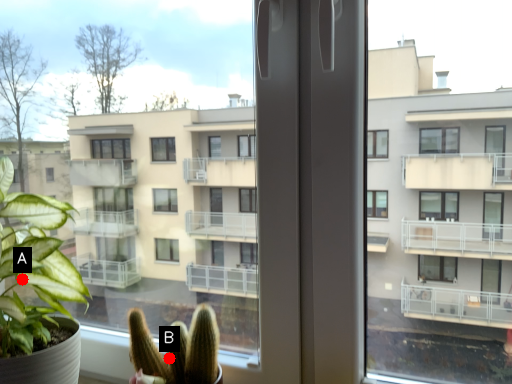
Question: Two points are circled on the image, labeled by A and B beside each circle. Among these points, which one is farthest from the camera?

Choices:
 (A) A is further
 (B) B is further

Answer: (A)